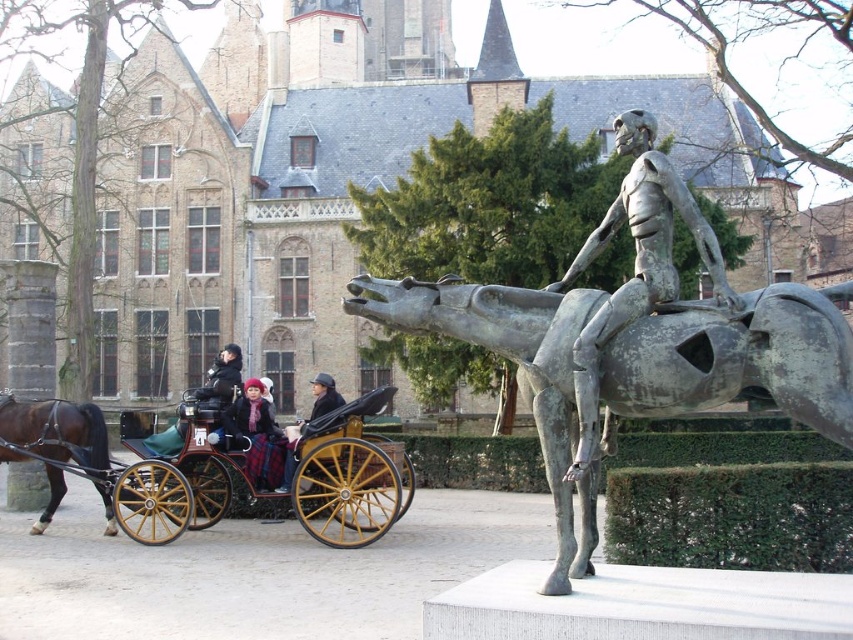
Is wooden polished cart at center below bronze skeleton at center?

Yes, wooden polished cart at center is below bronze skeleton at center.

The image size is (853, 640). Describe the element at coordinates (267, 477) in the screenshot. I see `wooden polished cart at center` at that location.

Is point (119, 497) more distant than point (590, 241)?

Yes.

The width and height of the screenshot is (853, 640). What are the coordinates of `wooden polished cart at center` in the screenshot? It's located at (267, 477).

Who is more forward, (276, 468) or (215, 384)?

Point (276, 468) is in front.

Can you confirm if plaid fabric coat at center is smaller than dark blue coat at center?

Correct, plaid fabric coat at center occupies less space than dark blue coat at center.

Is point (264, 452) positioned behind point (227, 374)?

No, it is not.

Find the location of a particular element. This screenshot has width=853, height=640. plaid fabric coat at center is located at coordinates (257, 435).

Is point (654, 269) less distant than point (326, 384)?

That is True.

Does bronze skeleton at center have a lesser height compared to matte black coat at center?

In fact, bronze skeleton at center may be taller than matte black coat at center.

Measure the distance between bronze skeleton at center and camera.

bronze skeleton at center and camera are 85.47 feet apart.

Where is `bronze skeleton at center`? The height and width of the screenshot is (640, 853). bronze skeleton at center is located at coordinates (634, 268).